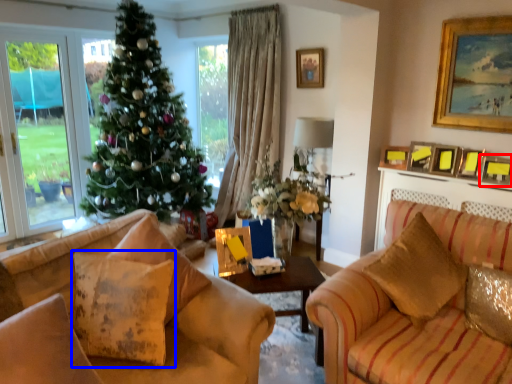
Question: Which object appears farthest to the camera in this image, picture frame (highlighted by a red box) or pillow (highlighted by a blue box)?

Choices:
 (A) picture frame
 (B) pillow

Answer: (A)